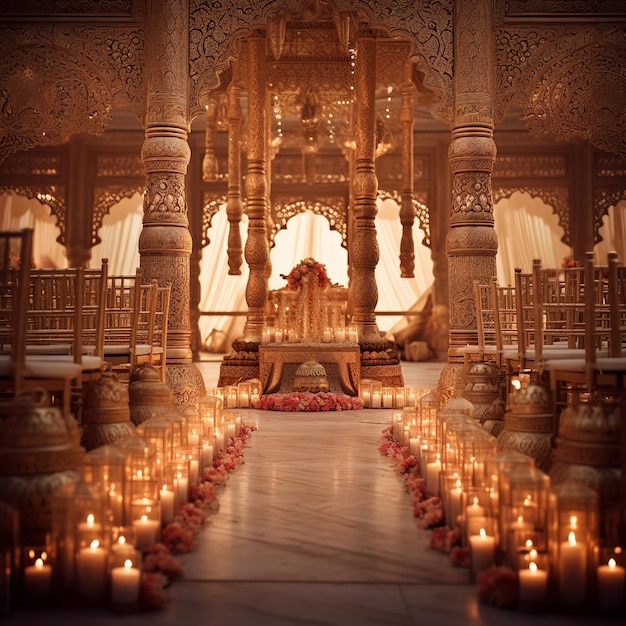
Locate an element on the screen. This screenshot has height=626, width=626. pillar is located at coordinates (171, 196).